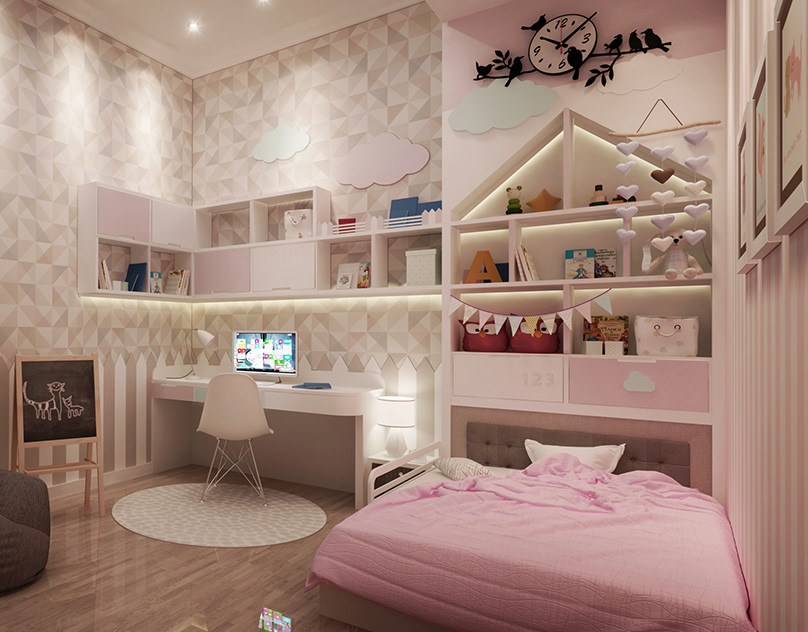
Identify the location of wall clock. The height and width of the screenshot is (632, 808). (562, 39).